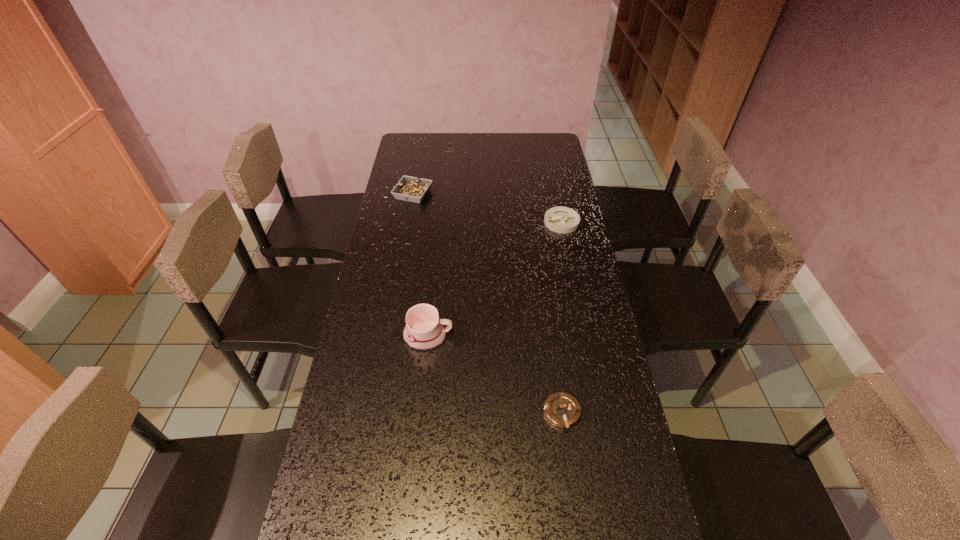
Identify the location of empty space that is in between the tallest object and the leftmost ashtray. This screenshot has height=540, width=960. (420, 265).

Identify the location of vacant area that lies between the second farthest object and the farthest object. The height and width of the screenshot is (540, 960). (488, 208).

Find the location of a particular element. vacant area that lies between the leftmost ashtray and the nearest ashtray is located at coordinates click(x=488, y=303).

Locate an element on the screen. Image resolution: width=960 pixels, height=540 pixels. empty location between the leftmost ashtray and the shortest ashtray is located at coordinates (488, 303).

Image resolution: width=960 pixels, height=540 pixels. I want to click on empty space between the second farthest object and the farthest ashtray, so click(488, 208).

Locate an element on the screen. Image resolution: width=960 pixels, height=540 pixels. free space between the nearest object and the third farthest object is located at coordinates (495, 374).

You are a GUI agent. You are given a task and a screenshot of the screen. Output one action in this format:
    pyautogui.click(x=<x>, y=<y>)
    Task: Click on the free space between the nearest ashtray and the farthest ashtray
    The height and width of the screenshot is (540, 960).
    Given the screenshot: What is the action you would take?
    pyautogui.click(x=488, y=303)

Select which object appears as the second closest to the farthest ashtray. Please provide its 2D coordinates. Your answer should be formatted as a tuple, i.e. [(x, y)], where the tuple contains the x and y coordinates of a point satisfying the conditions above.

[(424, 331)]

Point out which object is positioned as the second nearest to the mug. Please provide its 2D coordinates. Your answer should be formatted as a tuple, i.e. [(x, y)], where the tuple contains the x and y coordinates of a point satisfying the conditions above.

[(560, 219)]

Identify the location of the third closest ashtray relative to the tallest object. This screenshot has height=540, width=960. (411, 189).